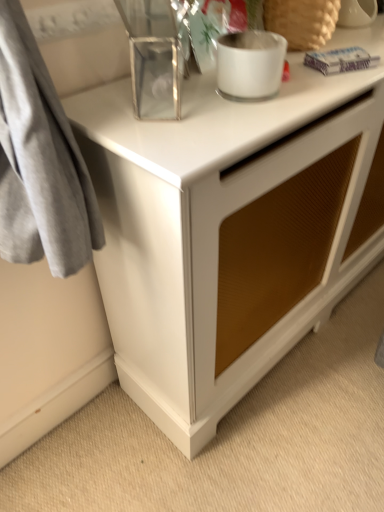
The height and width of the screenshot is (512, 384). Describe the element at coordinates (229, 229) in the screenshot. I see `white glossy cabinet at center` at that location.

Locate an element on the screen. Image resolution: width=384 pixels, height=512 pixels. white ceramic vase at upper right, which is the 1th appliance from right to left is located at coordinates (357, 13).

From the image's perspective, between clear glass rectangular box at upper center, acting as the third appliance starting from the right, and white glossy cabinet at center, which one is located above?

clear glass rectangular box at upper center, acting as the third appliance starting from the right, appears higher in the image.

Is clear glass rectangular box at upper center, acting as the third appliance starting from the right, directly adjacent to white glossy cabinet at center?

No, clear glass rectangular box at upper center, acting as the third appliance starting from the right, is not with white glossy cabinet at center.

In terms of width, does clear glass rectangular box at upper center, acting as the third appliance starting from the right, look wider or thinner when compared to white glossy cabinet at center?

clear glass rectangular box at upper center, acting as the third appliance starting from the right, is thinner than white glossy cabinet at center.

Is clear glass rectangular box at upper center, acting as the third appliance starting from the right, bigger than white glossy cabinet at center?

No.

From the image's perspective, between white glossy cabinet at center and clear glass rectangular box at upper center, which ranks as the 1th appliance in left-to-right order, who is located below?

white glossy cabinet at center appears lower in the image.

Between white glossy cabinet at center and clear glass rectangular box at upper center, acting as the third appliance starting from the right, which one has larger size?

Bigger between the two is white glossy cabinet at center.

Could you tell me if white glossy cabinet at center is facing clear glass rectangular box at upper center, which ranks as the 1th appliance in left-to-right order?

No, white glossy cabinet at center is not turned towards clear glass rectangular box at upper center, which ranks as the 1th appliance in left-to-right order.

Is white glossy cabinet at center not close to clear glass rectangular box at upper center, acting as the third appliance starting from the right?

That's not correct — white glossy cabinet at center is a little close to clear glass rectangular box at upper center, acting as the third appliance starting from the right.

From a real-world perspective, who is located lower, frosted glass candle at upper center, the 2th appliance in the left-to-right sequence, or white glossy cabinet at center?

white glossy cabinet at center.

Could you tell me if frosted glass candle at upper center, the 2th appliance in the left-to-right sequence, is turned towards white glossy cabinet at center?

No, frosted glass candle at upper center, the 2th appliance in the left-to-right sequence, is not aimed at white glossy cabinet at center.

Is frosted glass candle at upper center, the 2th appliance in the left-to-right sequence, wider than white glossy cabinet at center?

In fact, frosted glass candle at upper center, the 2th appliance in the left-to-right sequence, might be narrower than white glossy cabinet at center.

Considering the relative positions of white ceramic vase at upper right, the third appliance positioned from the left, and white glossy cabinet at center in the image provided, is white ceramic vase at upper right, the third appliance positioned from the left, behind white glossy cabinet at center?

Yes, white ceramic vase at upper right, the third appliance positioned from the left, is behind white glossy cabinet at center.

Based on the photo, between white ceramic vase at upper right, the third appliance positioned from the left, and white glossy cabinet at center, which one has less height?

Standing shorter between the two is white ceramic vase at upper right, the third appliance positioned from the left.

Do you think white ceramic vase at upper right, which is the 1th appliance from right to left, is within white glossy cabinet at center, or outside of it?

white ceramic vase at upper right, which is the 1th appliance from right to left, exists outside the volume of white glossy cabinet at center.

Does point (344, 13) come closer to viewer compared to point (168, 301)?

No, it is not.

Is point (219, 79) positioned behind point (359, 24)?

No, it is in front of (359, 24).

In the image, is frosted glass candle at upper center, which ranks as the second appliance in right-to-left order, on the left side or the right side of white ceramic vase at upper right, which is the 1th appliance from right to left?

frosted glass candle at upper center, which ranks as the second appliance in right-to-left order, is to the left of white ceramic vase at upper right, which is the 1th appliance from right to left.

From a real-world perspective, relative to white ceramic vase at upper right, which is the 1th appliance from right to left, is frosted glass candle at upper center, which ranks as the second appliance in right-to-left order, vertically above or below?

frosted glass candle at upper center, which ranks as the second appliance in right-to-left order, is below white ceramic vase at upper right, which is the 1th appliance from right to left.

Considering the sizes of clear glass rectangular box at upper center, which ranks as the 1th appliance in left-to-right order, and frosted glass candle at upper center, the 2th appliance in the left-to-right sequence, in the image, is clear glass rectangular box at upper center, which ranks as the 1th appliance in left-to-right order, taller or shorter than frosted glass candle at upper center, the 2th appliance in the left-to-right sequence,?

clear glass rectangular box at upper center, which ranks as the 1th appliance in left-to-right order, is taller than frosted glass candle at upper center, the 2th appliance in the left-to-right sequence.

Measure the distance between clear glass rectangular box at upper center, acting as the third appliance starting from the right, and frosted glass candle at upper center, which ranks as the second appliance in right-to-left order.

clear glass rectangular box at upper center, acting as the third appliance starting from the right, is 4.69 inches away from frosted glass candle at upper center, which ranks as the second appliance in right-to-left order.

Looking at this image, is clear glass rectangular box at upper center, acting as the third appliance starting from the right, at the left side of frosted glass candle at upper center, the 2th appliance in the left-to-right sequence?

Indeed, clear glass rectangular box at upper center, acting as the third appliance starting from the right, is positioned on the left side of frosted glass candle at upper center, the 2th appliance in the left-to-right sequence.

From a real-world perspective, between clear glass rectangular box at upper center, which ranks as the 1th appliance in left-to-right order, and frosted glass candle at upper center, which ranks as the second appliance in right-to-left order, who is vertically lower?

frosted glass candle at upper center, which ranks as the second appliance in right-to-left order, from a real-world perspective.

Is white glossy cabinet at center positioned behind frosted glass candle at upper center, the 2th appliance in the left-to-right sequence?

That is False.

Considering the points (154, 195) and (246, 41), which point is behind, point (154, 195) or point (246, 41)?

Positioned behind is point (246, 41).

From a real-world perspective, does white glossy cabinet at center sit lower than frosted glass candle at upper center, the 2th appliance in the left-to-right sequence?

Yes, from a real-world perspective, white glossy cabinet at center is beneath frosted glass candle at upper center, the 2th appliance in the left-to-right sequence.

Considering the sizes of objects white glossy cabinet at center and frosted glass candle at upper center, the 2th appliance in the left-to-right sequence, in the image provided, who is shorter, white glossy cabinet at center or frosted glass candle at upper center, the 2th appliance in the left-to-right sequence,?

frosted glass candle at upper center, the 2th appliance in the left-to-right sequence, is shorter.

In order to click on desk below the clear glass rectangular box at upper center, which ranks as the 1th appliance in left-to-right order (from the image's perspective) in this screenshot , I will do `click(229, 229)`.

The height and width of the screenshot is (512, 384). What are the coordinates of `desk below the clear glass rectangular box at upper center, acting as the third appliance starting from the right (from a real-world perspective)` in the screenshot? It's located at tap(229, 229).

From the image, which object appears to be farther from frosted glass candle at upper center, the 2th appliance in the left-to-right sequence, clear glass rectangular box at upper center, which ranks as the 1th appliance in left-to-right order, or white glossy cabinet at center?

white glossy cabinet at center is further to frosted glass candle at upper center, the 2th appliance in the left-to-right sequence.

Consider the image. Considering their positions, is clear glass rectangular box at upper center, acting as the third appliance starting from the right, positioned closer to frosted glass candle at upper center, which ranks as the second appliance in right-to-left order, than white ceramic vase at upper right, which is the 1th appliance from right to left?

clear glass rectangular box at upper center, acting as the third appliance starting from the right, is positioned closer to the anchor frosted glass candle at upper center, which ranks as the second appliance in right-to-left order.

From the image, which object appears to be farther from clear glass rectangular box at upper center, which ranks as the 1th appliance in left-to-right order, white ceramic vase at upper right, the third appliance positioned from the left, or frosted glass candle at upper center, which ranks as the second appliance in right-to-left order?

Based on the image, white ceramic vase at upper right, the third appliance positioned from the left, appears to be further to clear glass rectangular box at upper center, which ranks as the 1th appliance in left-to-right order.

Considering their positions, is white ceramic vase at upper right, which is the 1th appliance from right to left, positioned further to white glossy cabinet at center than frosted glass candle at upper center, the 2th appliance in the left-to-right sequence?

The object further to white glossy cabinet at center is white ceramic vase at upper right, which is the 1th appliance from right to left.

Which object lies nearer to the anchor point clear glass rectangular box at upper center, which ranks as the 1th appliance in left-to-right order, frosted glass candle at upper center, the 2th appliance in the left-to-right sequence, or white glossy cabinet at center?

frosted glass candle at upper center, the 2th appliance in the left-to-right sequence, lies closer to clear glass rectangular box at upper center, which ranks as the 1th appliance in left-to-right order, than the other object.

Based on their spatial positions, is clear glass rectangular box at upper center, which ranks as the 1th appliance in left-to-right order, or white glossy cabinet at center further from white ceramic vase at upper right, the third appliance positioned from the left?

white glossy cabinet at center is positioned further to the anchor white ceramic vase at upper right, the third appliance positioned from the left.

From the image, which object appears to be farther from white ceramic vase at upper right, the third appliance positioned from the left, clear glass rectangular box at upper center, acting as the third appliance starting from the right, or frosted glass candle at upper center, which ranks as the second appliance in right-to-left order?

clear glass rectangular box at upper center, acting as the third appliance starting from the right, lies further to white ceramic vase at upper right, the third appliance positioned from the left, than the other object.

From the image, which object appears to be farther from frosted glass candle at upper center, which ranks as the second appliance in right-to-left order, white glossy cabinet at center or clear glass rectangular box at upper center, acting as the third appliance starting from the right?

Among the two, white glossy cabinet at center is located further to frosted glass candle at upper center, which ranks as the second appliance in right-to-left order.

At what (x,y) coordinates should I click in order to perform the action: click on appliance between clear glass rectangular box at upper center, acting as the third appliance starting from the right, and white glossy cabinet at center from left to right. Please return your answer as a coordinate pair (x, y). This screenshot has height=512, width=384. Looking at the image, I should click on (250, 64).

I want to click on appliance situated between clear glass rectangular box at upper center, acting as the third appliance starting from the right, and white ceramic vase at upper right, which is the 1th appliance from right to left, from left to right, so click(x=250, y=64).

Where is `desk between clear glass rectangular box at upper center, which ranks as the 1th appliance in left-to-right order, and white ceramic vase at upper right, which is the 1th appliance from right to left`? desk between clear glass rectangular box at upper center, which ranks as the 1th appliance in left-to-right order, and white ceramic vase at upper right, which is the 1th appliance from right to left is located at coordinates (229, 229).